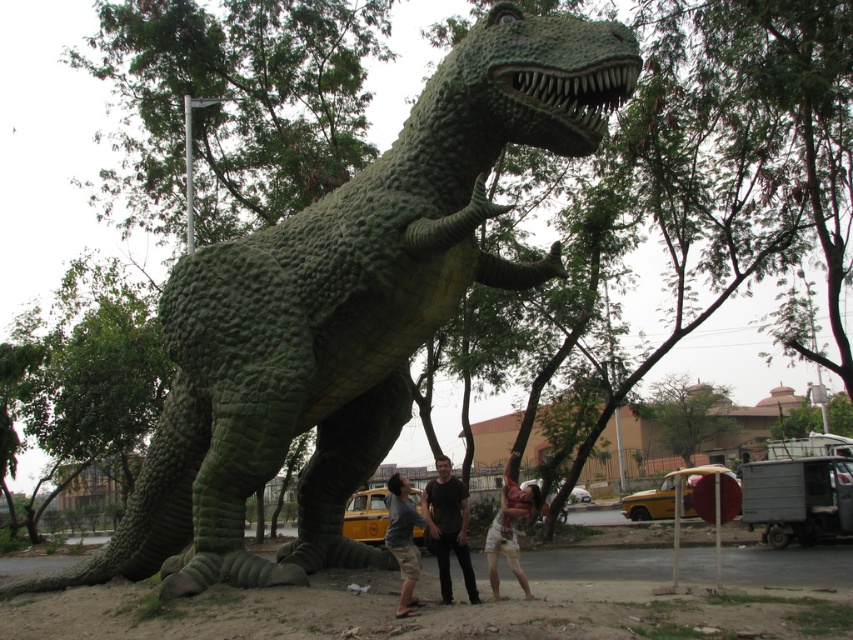
Question: Is green rough textured dinosaur at center thinner than light brown shorts at lower center?

Choices:
 (A) yes
 (B) no

Answer: (A)

Question: Observing the image, what is the correct spatial positioning of dark brown shirt at center in reference to light brown cotton shorts at center?

Choices:
 (A) right
 (B) left

Answer: (A)

Question: Which of the following is the closest to the observer?

Choices:
 (A) green rough textured dinosaur at center
 (B) dark brown shirt at center

Answer: (A)

Question: Among these objects, which one is farthest from the camera?

Choices:
 (A) light brown shorts at lower center
 (B) light brown cotton shorts at center
 (C) green rough textured dinosaur at center

Answer: (A)

Question: Which of the following is the farthest from the observer?

Choices:
 (A) (318, 451)
 (B) (422, 493)
 (C) (512, 538)
 (D) (461, 512)

Answer: (B)

Question: Where is green rough textured dinosaur at center located in relation to dark brown shirt at center in the image?

Choices:
 (A) left
 (B) right

Answer: (B)